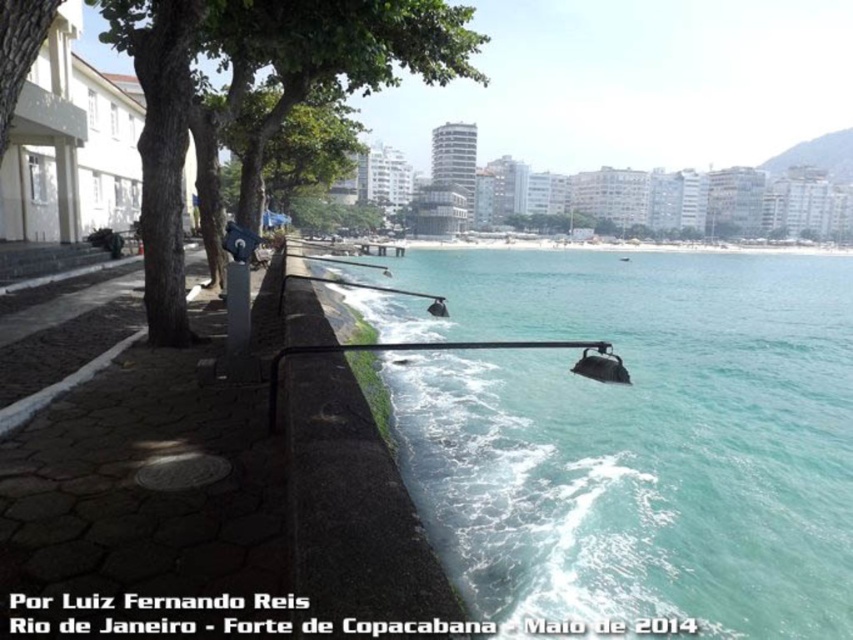
You are standing on the waterfront promenade at Forte de Copacabana and want to take a photo of two specific points. The first point is at coordinates point (167, 163) and the second point is at point (326, 180). Which point is closer to you?

Point (167, 163) is closer to the viewer than point (326, 180).

You are standing on the waterfront promenade at Forte de Copacabana. You want to take a photo of the clear blue water at lower center. If your camera can focus on objects up to 40 feet away, will you be able to capture a clear image of the water?

The clear blue water at lower center is 38.04 feet away from the camera, which is within the camera focus range of up to 40 feet. Therefore, you can capture a clear image of the clear blue water at lower center.